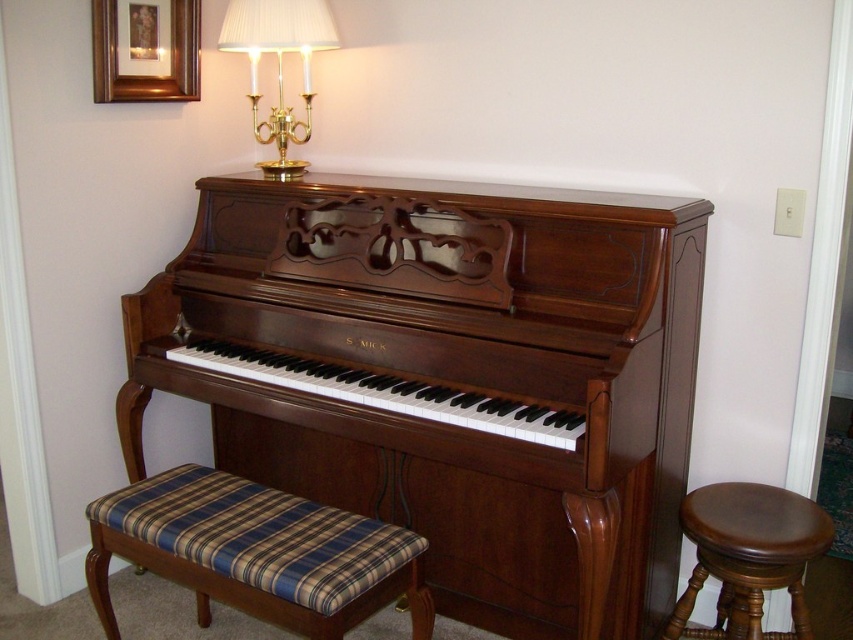
Question: Which object appears closest to the camera in this image?

Choices:
 (A) plaid fabric bench at lower left
 (B) brown leather stool at right
 (C) gold brass lamp at upper center
 (D) shiny brown piano at center

Answer: (A)

Question: Does plaid fabric bench at lower left appear over brown leather stool at right?

Choices:
 (A) yes
 (B) no

Answer: (A)

Question: Which of these objects is positioned farthest from the gold brass lamp at upper center?

Choices:
 (A) gold-framed picture at upper left
 (B) brown leather stool at right
 (C) plaid fabric bench at lower left

Answer: (B)

Question: Observing the image, what is the correct spatial positioning of shiny brown piano at center in reference to brown leather stool at right?

Choices:
 (A) right
 (B) left

Answer: (B)

Question: Which of the following is the farthest from the observer?

Choices:
 (A) (291, 28)
 (B) (424, 342)
 (C) (325, 604)

Answer: (A)

Question: Is brown leather stool at right to the right of gold-framed picture at upper left from the viewer's perspective?

Choices:
 (A) yes
 (B) no

Answer: (A)